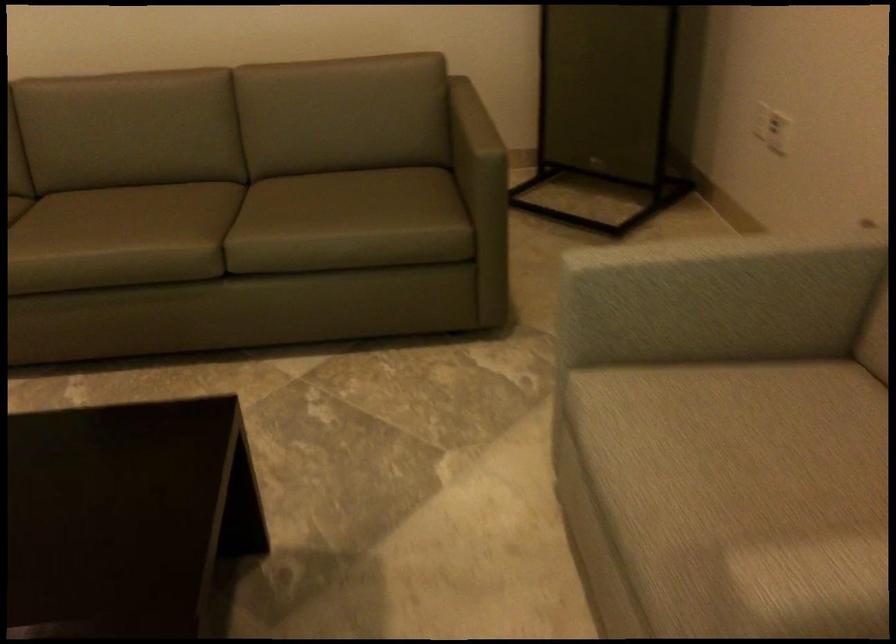
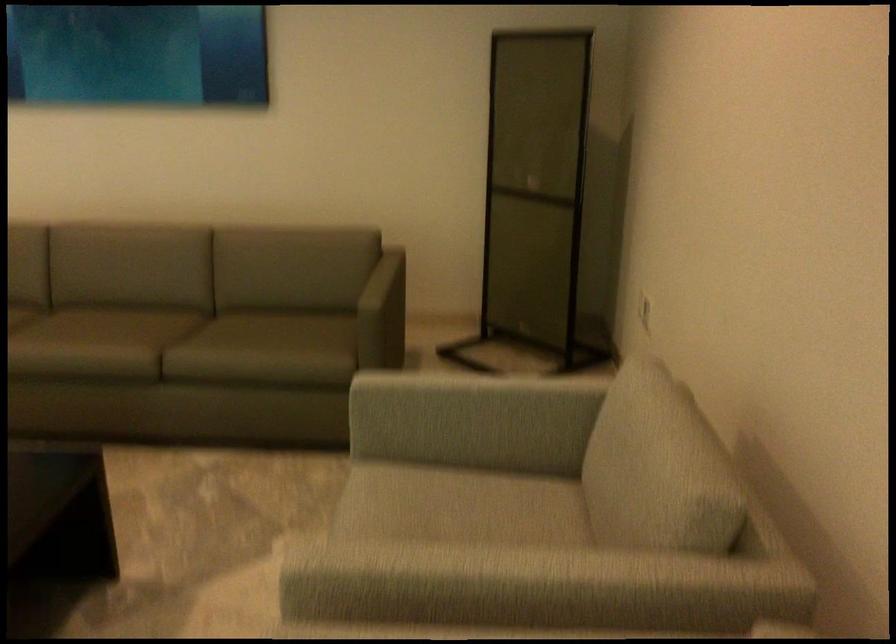
The point at (734, 397) is marked in the first image. Where is the corresponding point in the second image?

(455, 491)